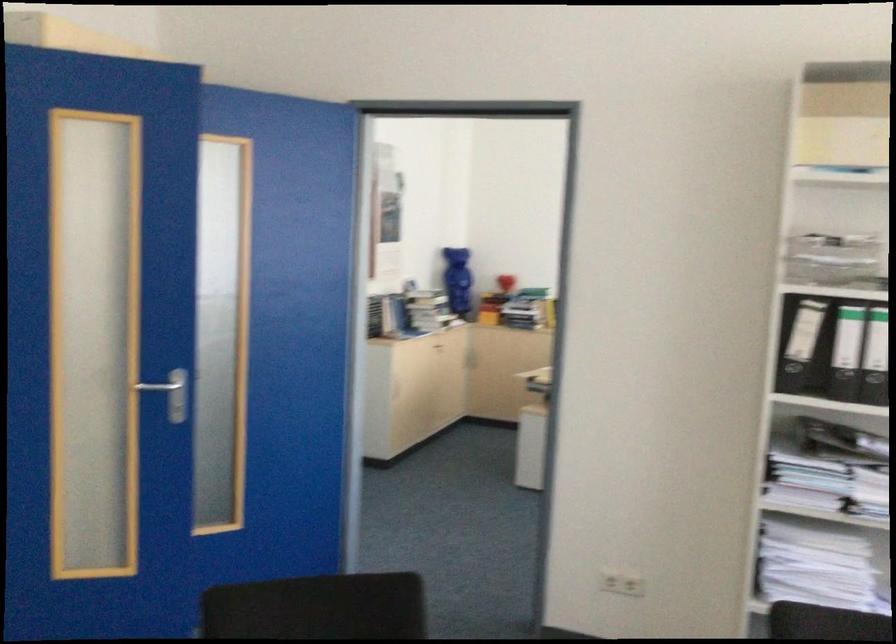
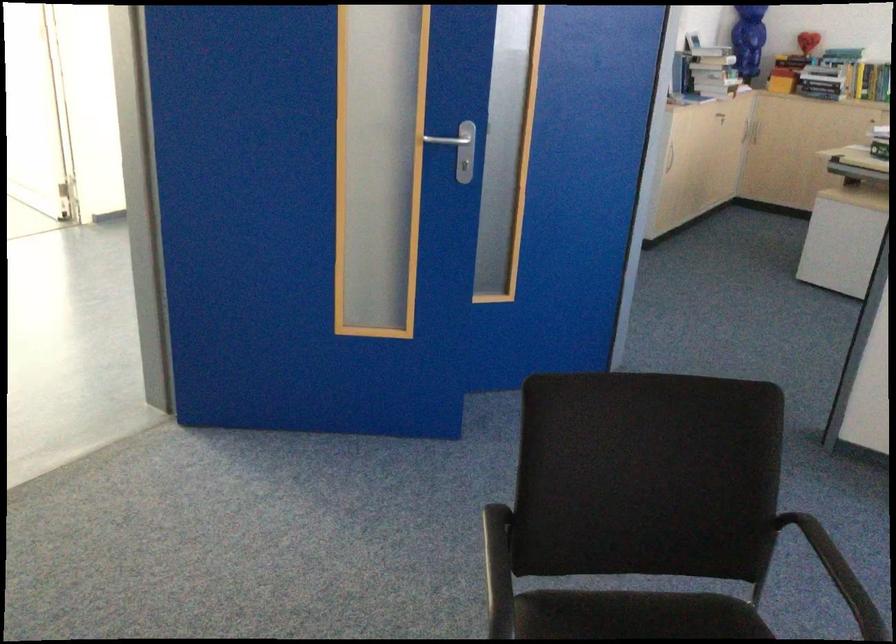
Which direction would the cameraman need to move to produce the second image?

The cameraman walked toward left, forward.